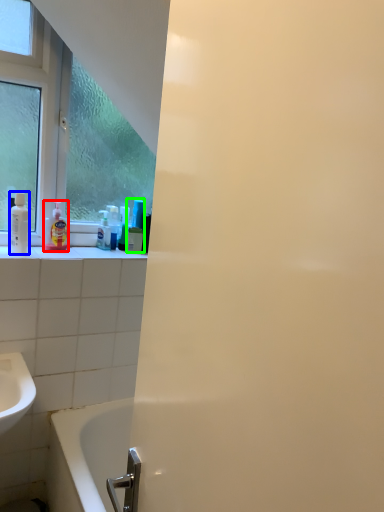
Question: Which is nearer to the cleaning product (highlighted by a red box)? mouthwash (highlighted by a blue box) or mouthwash (highlighted by a green box).

Choices:
 (A) mouthwash
 (B) mouthwash

Answer: (A)